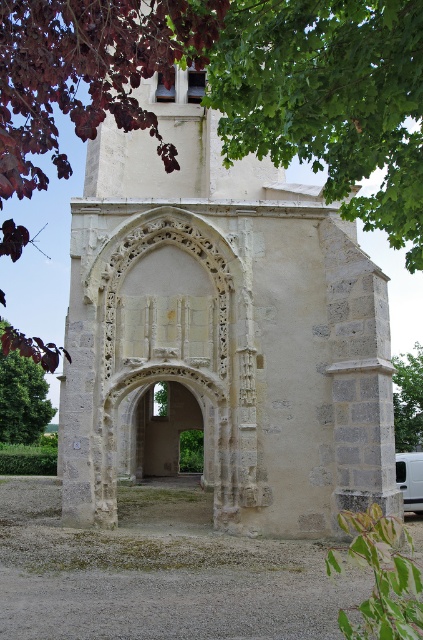
You are a tour guide leading visitors to a historical site. You want to take a group photo where the stone archway at center and the white matte van at right are both visible in the frame. Given that the camera you have can capture a maximum distance of 25 meters between the closest and farthest objects in focus, will you be able to capture both objects clearly in the same photo?

The distance between the stone archway at center and the white matte van at right is 26.54 meters, which exceeds the camera maximum distance of 25 meters. Therefore, it will not be possible to capture both objects clearly in the same photo.